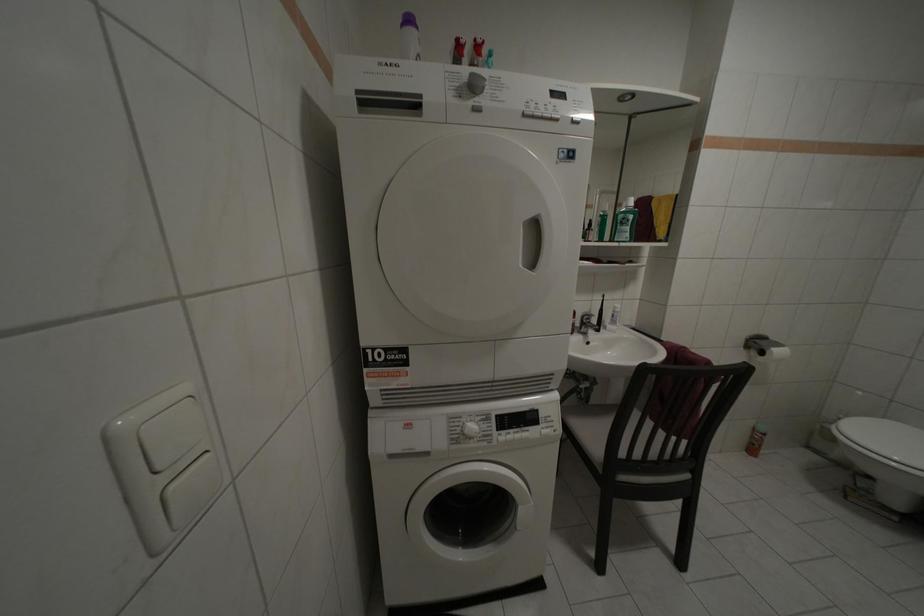
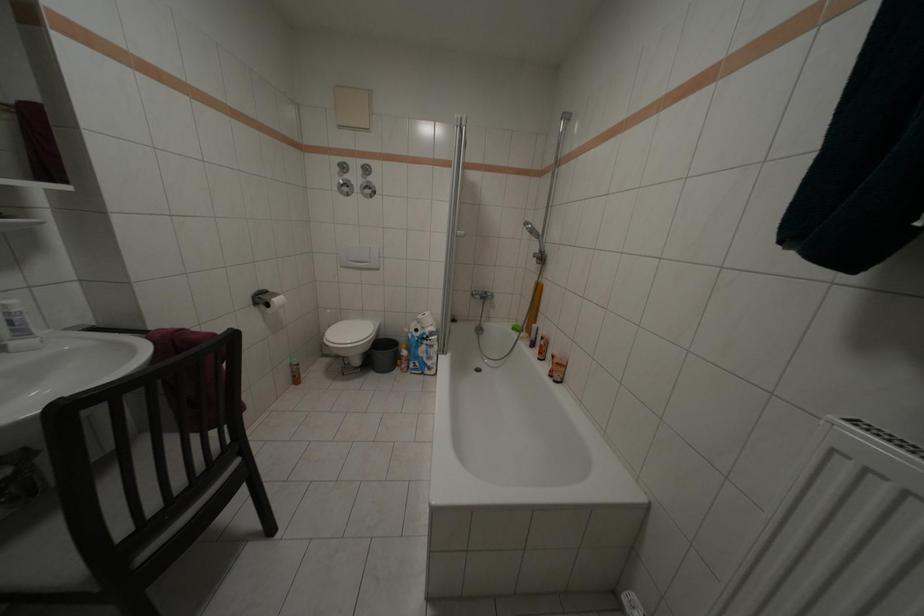
The images are taken continuously from a first-person perspective. In which direction is your viewpoint rotating?

The rotation direction of the camera is right-down.